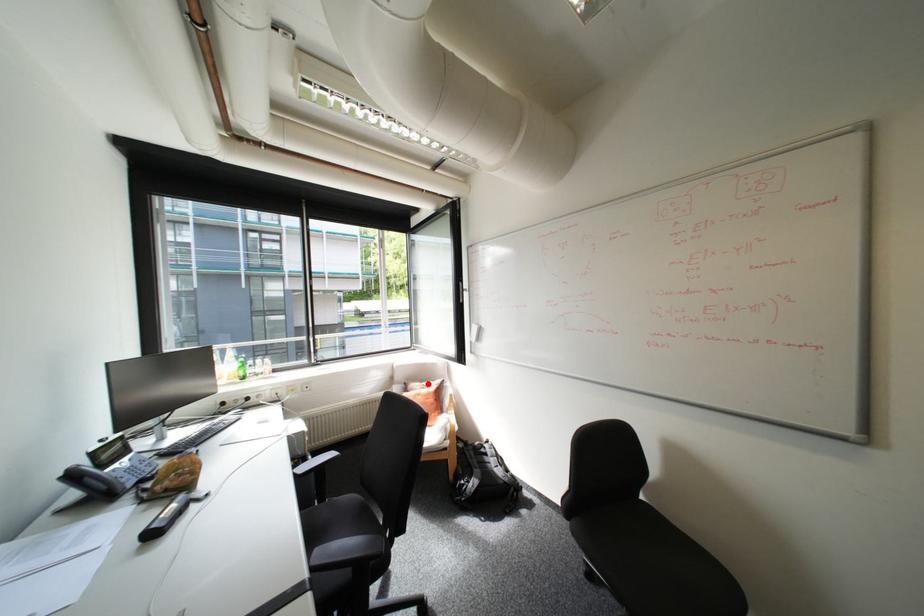
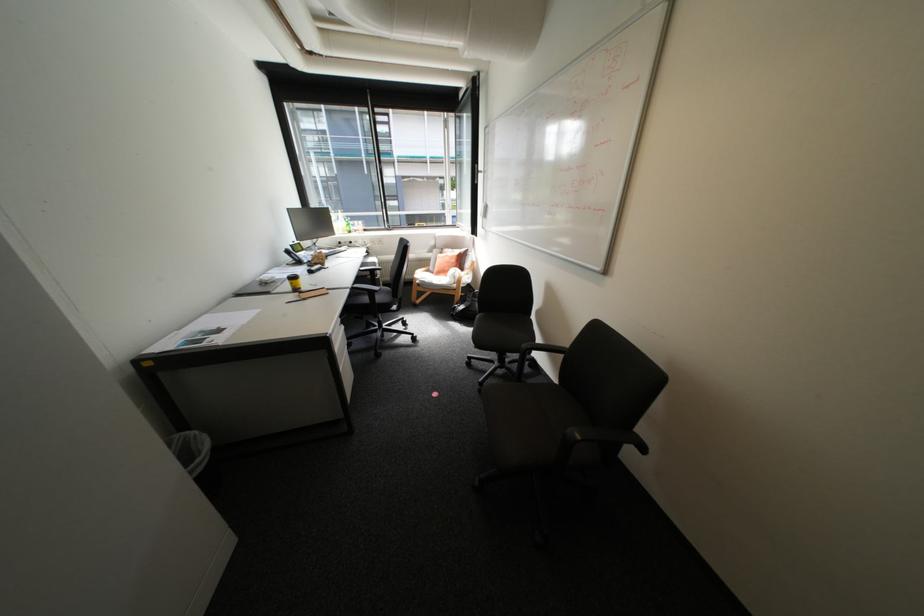
In the second image, find the point that corresponds to the highlighted location in the first image.

(459, 249)